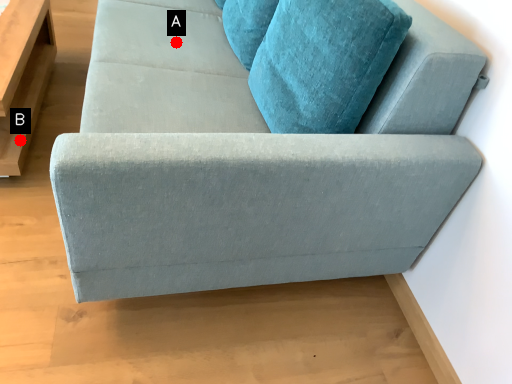
Question: Two points are circled on the image, labeled by A and B beside each circle. Which point is closer to the camera taking this photo?

Choices:
 (A) A is closer
 (B) B is closer

Answer: (B)